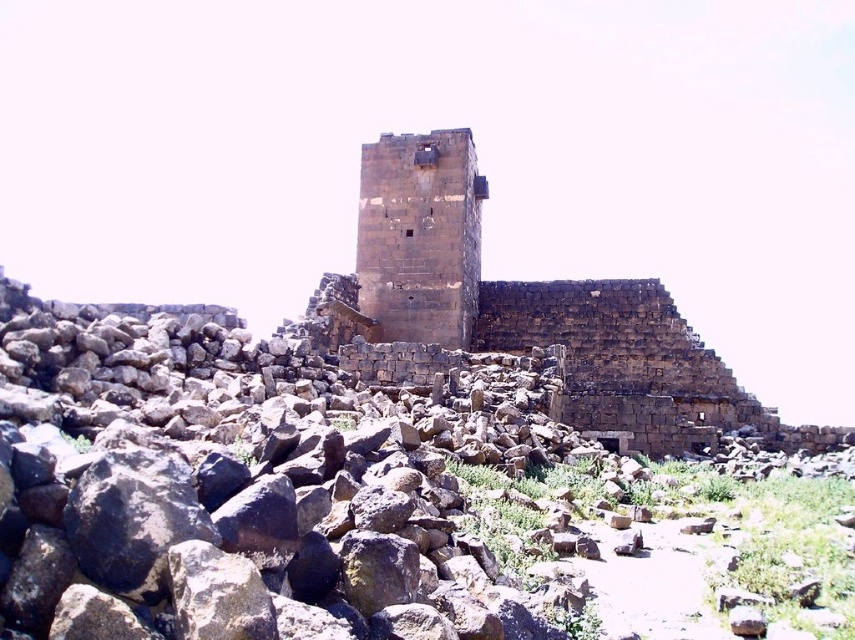
You are a historian standing at the base of the dark brown stone tower at center. You want to place a marker at the exact center of the tower. According to the coordinates provided, where should you place the marker?

The exact center of the dark brown stone tower at center is located at the coordinates point [513,310], so you should place the marker there.